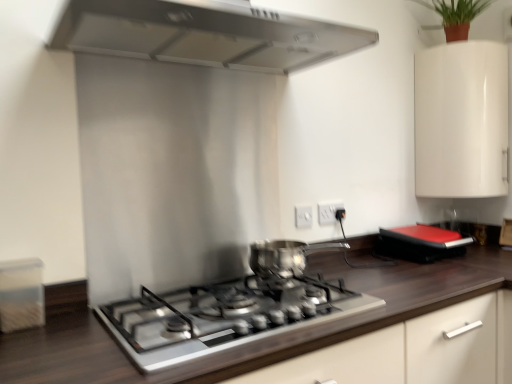
Question: From a real-world perspective, is green matte plant at upper right physically located above or below stainless steel range hood at upper center?

Choices:
 (A) below
 (B) above

Answer: (B)

Question: In terms of size, does green matte plant at upper right appear bigger or smaller than stainless steel range hood at upper center?

Choices:
 (A) big
 (B) small

Answer: (B)

Question: Which of these objects is positioned closest to the stainless steel range hood at upper center?

Choices:
 (A) white glossy cabinet at upper right
 (B) white plastic electric outlet at center, which ranks as the 1th electric outlet in front-to-back order
 (C) dark wood countertop at center
 (D) white plastic electric outlet at center, arranged as the second electric outlet when viewed from the front
 (E) satin silver gas stove at center

Answer: (A)

Question: Estimate the real-world distances between objects in this image. Which object is closer to the stainless steel range hood at upper center?

Choices:
 (A) shiny metallic pot at center
 (B) dark wood countertop at center
 (C) white plastic electric outlet at center, the 1th electric outlet positioned from the left
 (D) white plastic electric outlet at center, acting as the 1th electric outlet starting from the right
 (E) satin silver gas stove at center

Answer: (A)